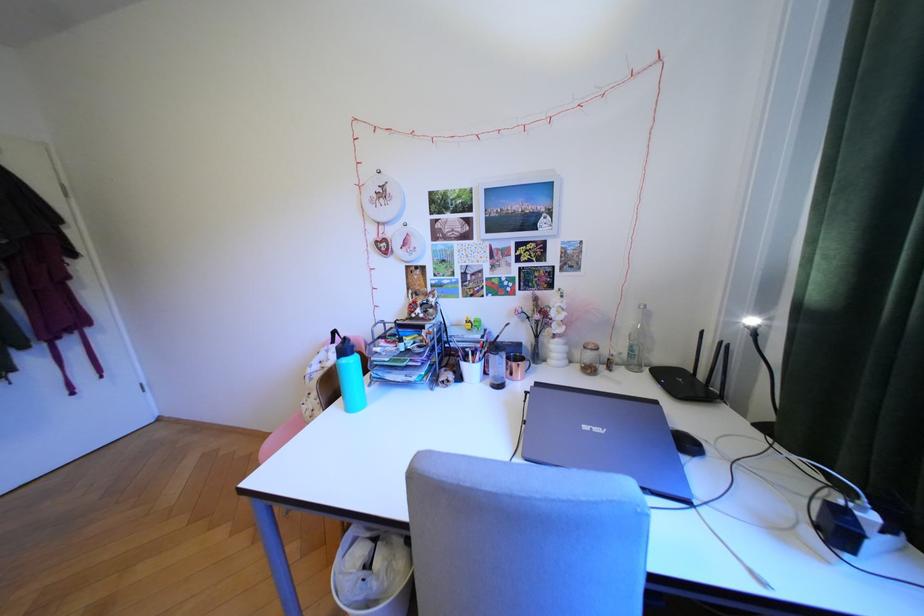
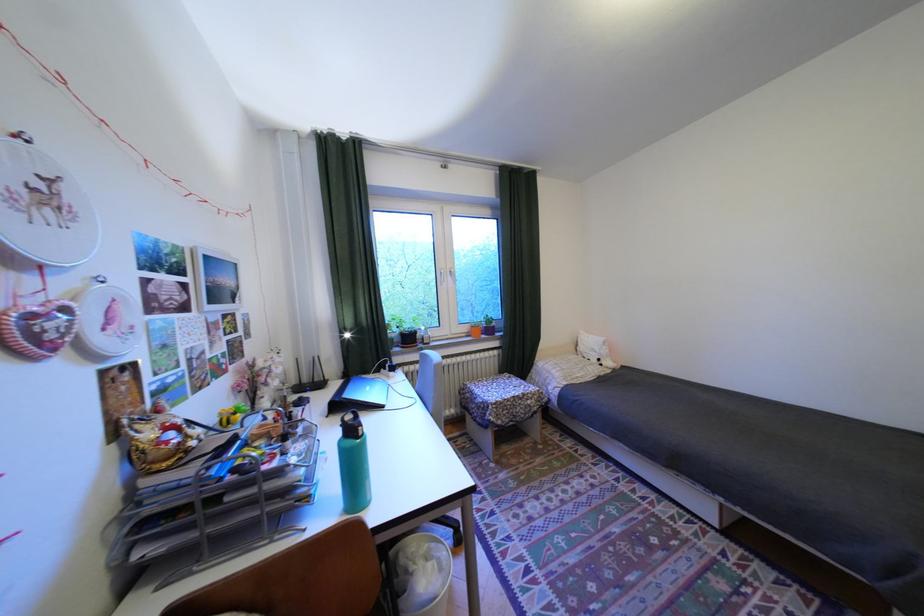
Where in the second image is the point corresponding to pixel 394 193 from the first image?

(58, 197)